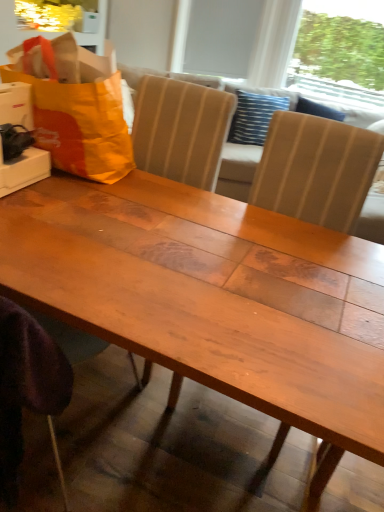
Identify the location of vacant space situated above wooden table at center (from a real-world perspective). This screenshot has height=512, width=384. (151, 443).